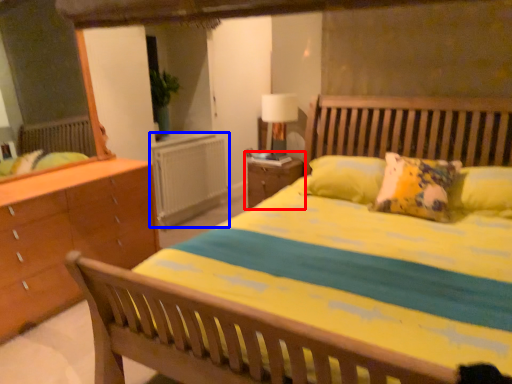
Question: Which object appears farthest to the camera in this image, nightstand (highlighted by a red box) or radiator (highlighted by a blue box)?

Choices:
 (A) nightstand
 (B) radiator

Answer: (B)